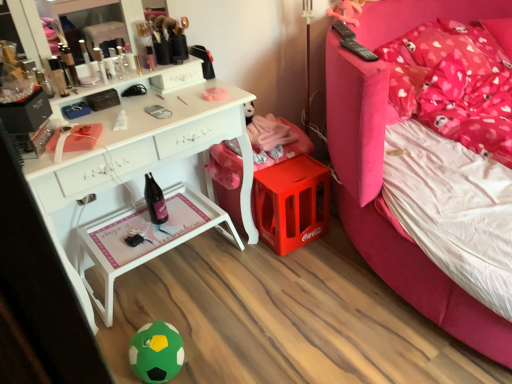
Question: Considering their positions, is white wood tray at lower center located in front of or behind green felt ball at lower center?

Choices:
 (A) behind
 (B) front

Answer: (A)

Question: Is white wood tray at lower center bigger or smaller than green felt ball at lower center?

Choices:
 (A) small
 (B) big

Answer: (B)

Question: Which of these objects is positioned farthest from the white wood tray at lower center?

Choices:
 (A) pink fabric bed at upper right
 (B) matte black compact at upper left
 (C) pink fabric pillow at upper right
 (D) green felt ball at lower center

Answer: (C)

Question: Based on their relative distances, which object is nearer to the white wood tray at lower center?

Choices:
 (A) pink fabric bed at upper right
 (B) matte black compact at upper left
 (C) green felt ball at lower center
 (D) pink fabric pillow at upper right

Answer: (C)